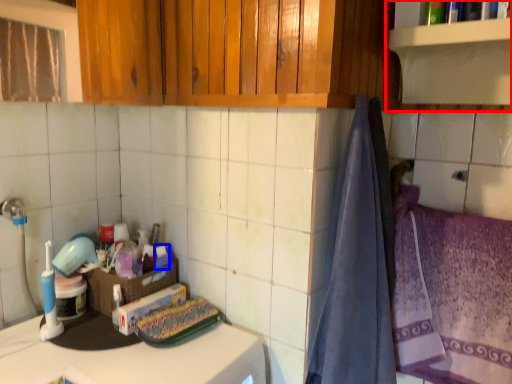
Question: Which of the following is the closest to the observer, shelf (highlighted by a red box) or toiletry (highlighted by a blue box)?

Choices:
 (A) shelf
 (B) toiletry

Answer: (A)